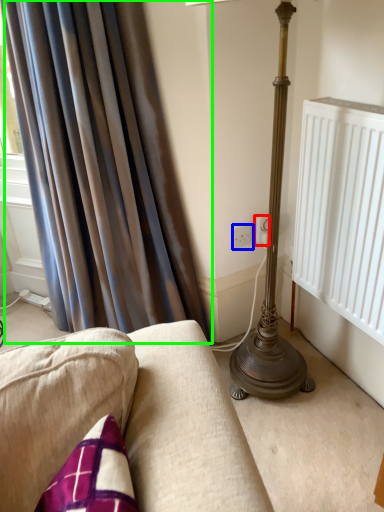
Question: Based on their relative distances, which object is nearer to electric outlet (highlighted by a red box)? Choose from electric outlet (highlighted by a blue box) and curtain (highlighted by a green box).

Choices:
 (A) electric outlet
 (B) curtain

Answer: (A)